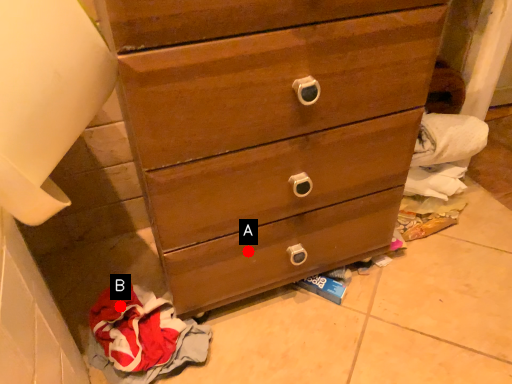
Question: Two points are circled on the image, labeled by A and B beside each circle. Which of the following is the closest to the observer?

Choices:
 (A) A is closer
 (B) B is closer

Answer: (A)